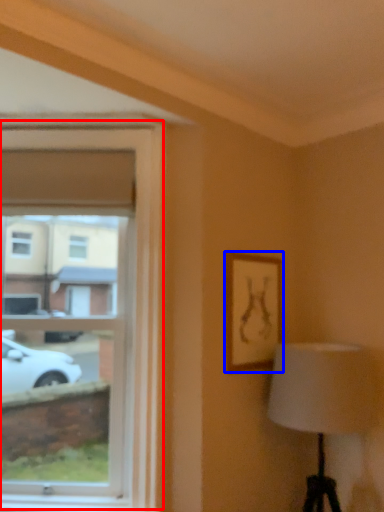
Question: Which of the following is the closest to the observer, window (highlighted by a red box) or picture frame (highlighted by a blue box)?

Choices:
 (A) window
 (B) picture frame

Answer: (A)